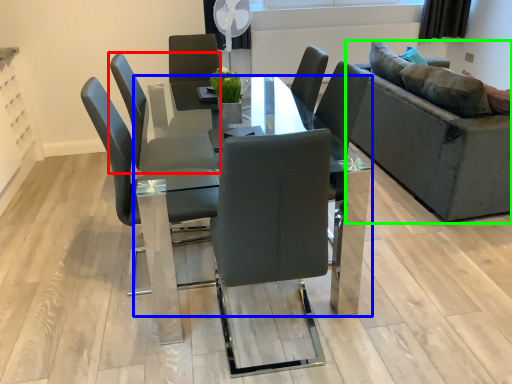
Question: Which is farther away from chair (highlighted by a red box)? table (highlighted by a blue box) or studio couch (highlighted by a green box)?

Choices:
 (A) table
 (B) studio couch

Answer: (B)